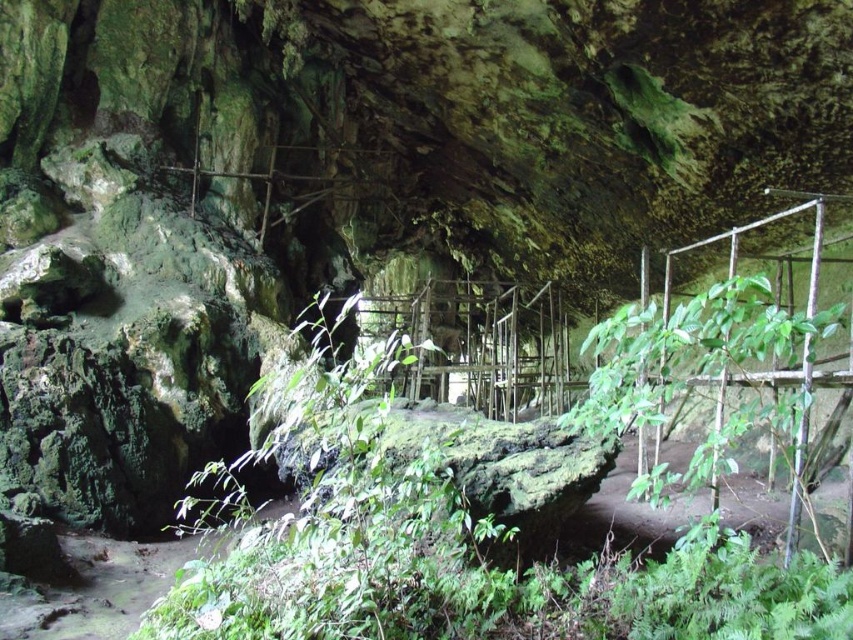
Question: Does green leafy plant at center have a greater width compared to green leafy plant at center right?

Choices:
 (A) no
 (B) yes

Answer: (A)

Question: Is green leafy plant at center wider than green leafy plant at center right?

Choices:
 (A) yes
 (B) no

Answer: (B)

Question: Which of the following is the closest to the observer?

Choices:
 (A) green leafy plant at center
 (B) green leafy plant at center right

Answer: (B)

Question: Is green leafy plant at center to the left of green leafy plant at center right from the viewer's perspective?

Choices:
 (A) yes
 (B) no

Answer: (A)